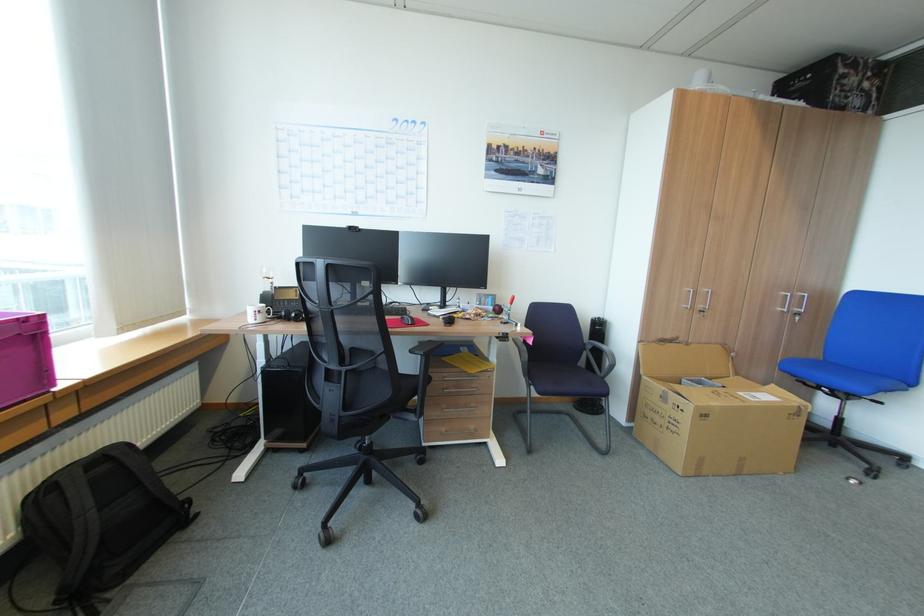
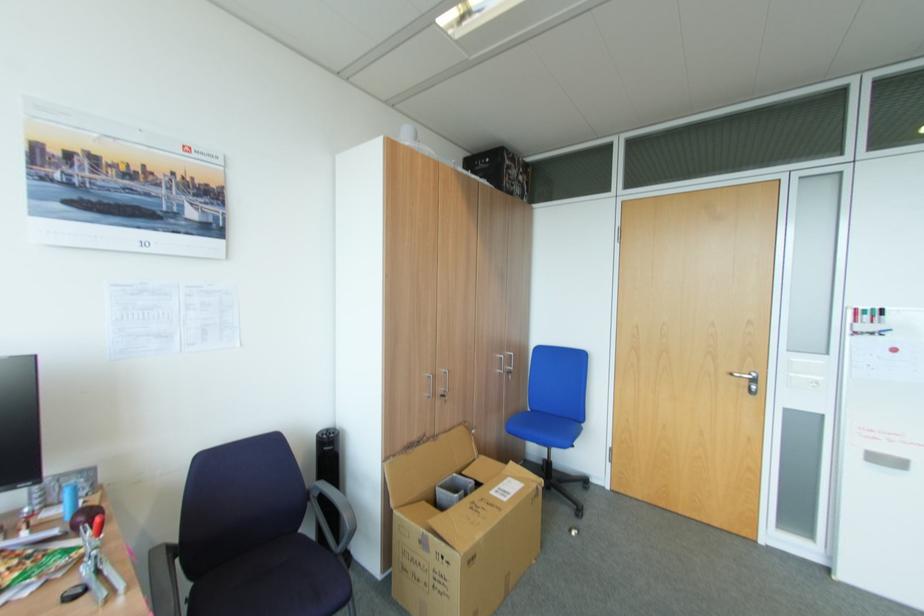
The point at (869, 110) is marked in the first image. Where is the corresponding point in the second image?

(528, 199)